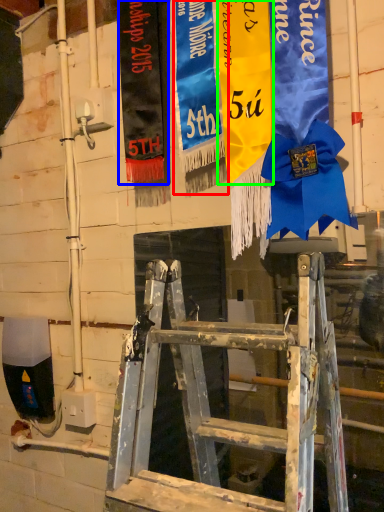
Question: Estimate the real-world distances between objects in this image. Which object is farther from tapestry (highlighted by a red box), tapestry (highlighted by a blue box) or tapestry (highlighted by a green box)?

Choices:
 (A) tapestry
 (B) tapestry

Answer: (A)